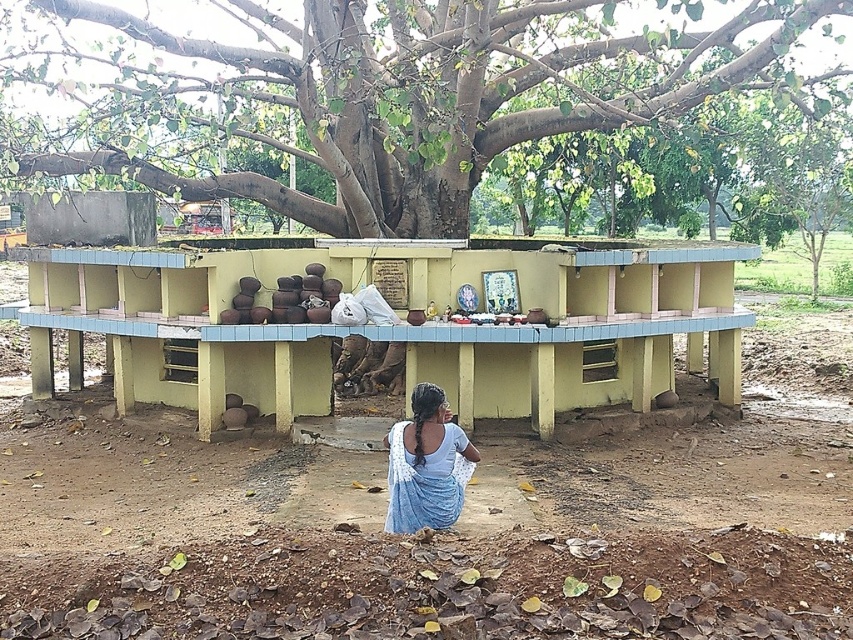
Question: Which point is closer to the camera?

Choices:
 (A) green textured tree at upper center
 (B) blue fabric at lower center
 (C) yellow painted concrete bench at center

Answer: (B)

Question: Is yellow painted concrete bench at center bigger than blue fabric at lower center?

Choices:
 (A) no
 (B) yes

Answer: (A)

Question: Which object is closer to the camera taking this photo?

Choices:
 (A) green textured tree at upper center
 (B) brown soil at lower center

Answer: (A)

Question: Which point is farther to the camera?

Choices:
 (A) (463, 177)
 (B) (209, 308)

Answer: (A)

Question: Is the position of brown soil at lower center less distant than that of green textured tree at upper center?

Choices:
 (A) yes
 (B) no

Answer: (B)

Question: Does brown soil at lower center appear on the left side of yellow painted concrete bench at center?

Choices:
 (A) no
 (B) yes

Answer: (B)